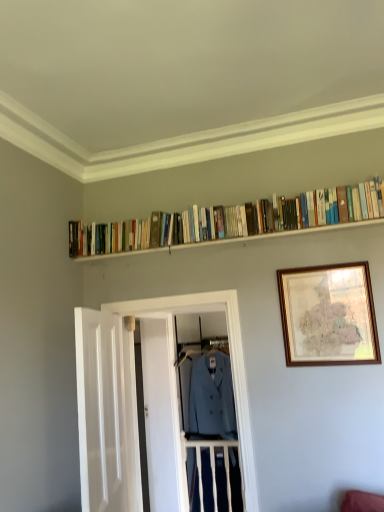
Question: Is white wooden door at left, the first door when ordered from front to back, wider than hardcover books at upper center?

Choices:
 (A) yes
 (B) no

Answer: (A)

Question: Can you confirm if white wooden door at left, the first door when ordered from front to back, is shorter than hardcover books at upper center?

Choices:
 (A) no
 (B) yes

Answer: (A)

Question: Considering the relative positions of white wooden door at left, positioned as the 2th door in back-to-front order, and hardcover books at upper center in the image provided, is white wooden door at left, positioned as the 2th door in back-to-front order, to the right of hardcover books at upper center from the viewer's perspective?

Choices:
 (A) yes
 (B) no

Answer: (B)

Question: Does white wooden door at left, positioned as the 2th door in back-to-front order, have a lesser width compared to hardcover books at upper center?

Choices:
 (A) yes
 (B) no

Answer: (B)

Question: From a real-world perspective, is white wooden door at left, the first door when ordered from front to back, on hardcover books at upper center?

Choices:
 (A) yes
 (B) no

Answer: (B)

Question: In terms of height, does wooden framed map at upper right look taller or shorter compared to white wooden door at center, the 2th door from the front?

Choices:
 (A) tall
 (B) short

Answer: (B)

Question: Is point 332,315 closer or farther from the camera than point 172,487?

Choices:
 (A) farther
 (B) closer

Answer: (B)

Question: From the image's perspective, is wooden framed map at upper right positioned above or below white wooden door at center, the 2th door from the front?

Choices:
 (A) below
 (B) above

Answer: (B)

Question: Visually, is wooden framed map at upper right positioned to the left or to the right of white wooden door at center, arranged as the first door when viewed from the back?

Choices:
 (A) left
 (B) right

Answer: (B)

Question: Is white wooden door at left, positioned as the 2th door in back-to-front order, situated inside hardcover books at upper center or outside?

Choices:
 (A) outside
 (B) inside

Answer: (A)

Question: Would you say white wooden door at left, positioned as the 2th door in back-to-front order, is to the left or to the right of hardcover books at upper center in the picture?

Choices:
 (A) left
 (B) right

Answer: (A)

Question: Is white wooden door at left, the first door when ordered from front to back, taller or shorter than hardcover books at upper center?

Choices:
 (A) tall
 (B) short

Answer: (A)

Question: From a real-world perspective, is white wooden door at left, the first door when ordered from front to back, positioned above or below hardcover books at upper center?

Choices:
 (A) below
 (B) above

Answer: (A)

Question: Is white wooden door at center, arranged as the first door when viewed from the back, taller or shorter than white wooden door at left, the first door when ordered from front to back?

Choices:
 (A) tall
 (B) short

Answer: (A)

Question: From a real-world perspective, is white wooden door at center, the 2th door from the front, above or below white wooden door at left, positioned as the 2th door in back-to-front order?

Choices:
 (A) below
 (B) above

Answer: (A)